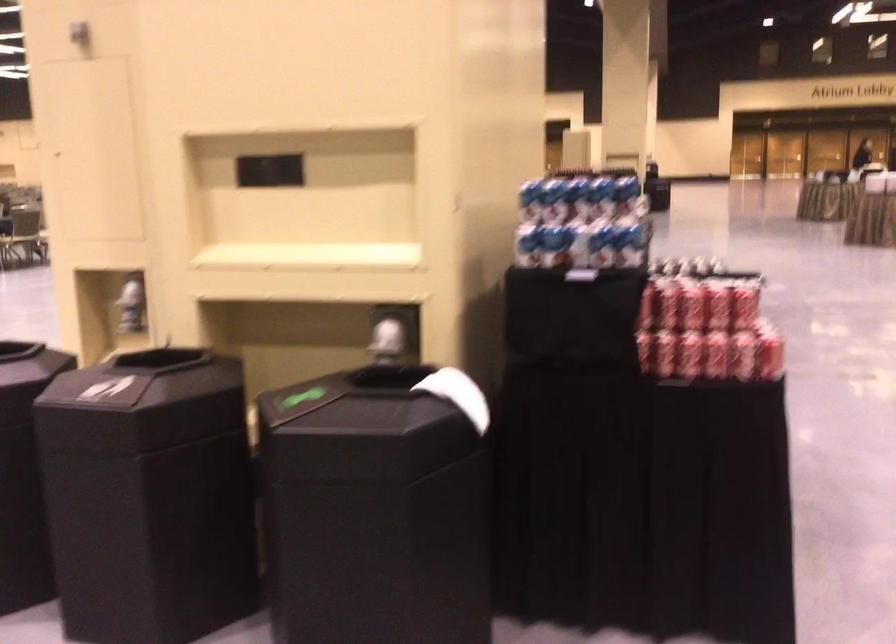
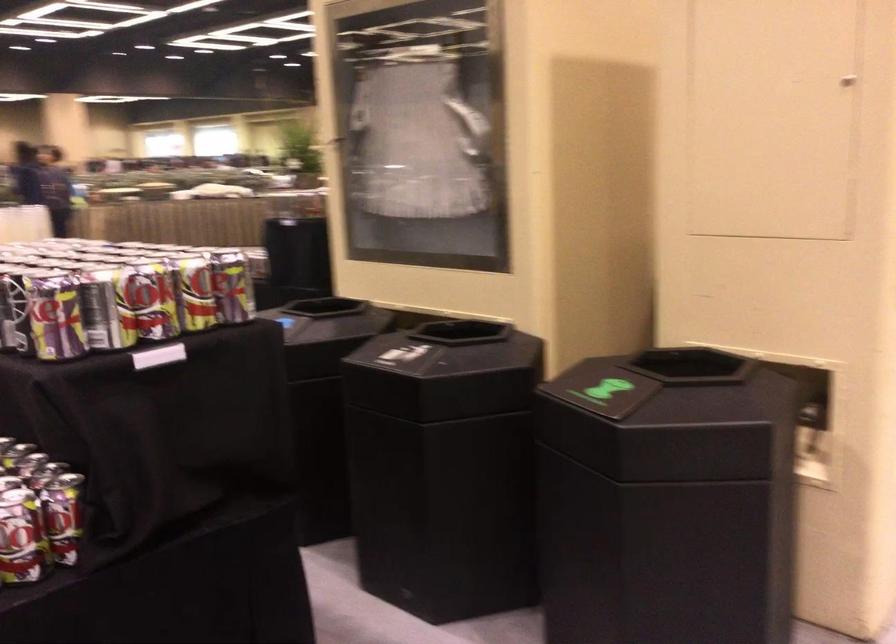
Question: I am providing you with two images of the same scene from different viewpoints. Please identify which objects are invisible in image2.

Choices:
 (A) black bin opening
 (B) red soda can
 (C) red whiteboard accessory
 (D) beverage can

Answer: (B)